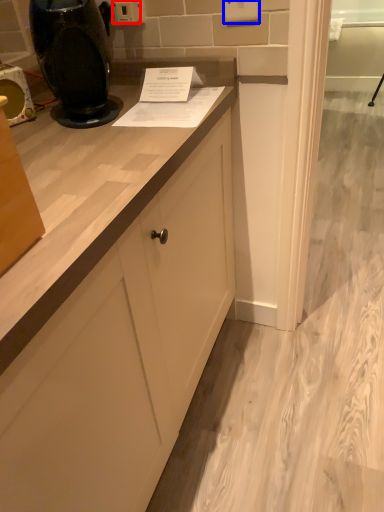
Question: Which object appears farthest to the camera in this image, electric outlet (highlighted by a red box) or electric outlet (highlighted by a blue box)?

Choices:
 (A) electric outlet
 (B) electric outlet

Answer: (A)